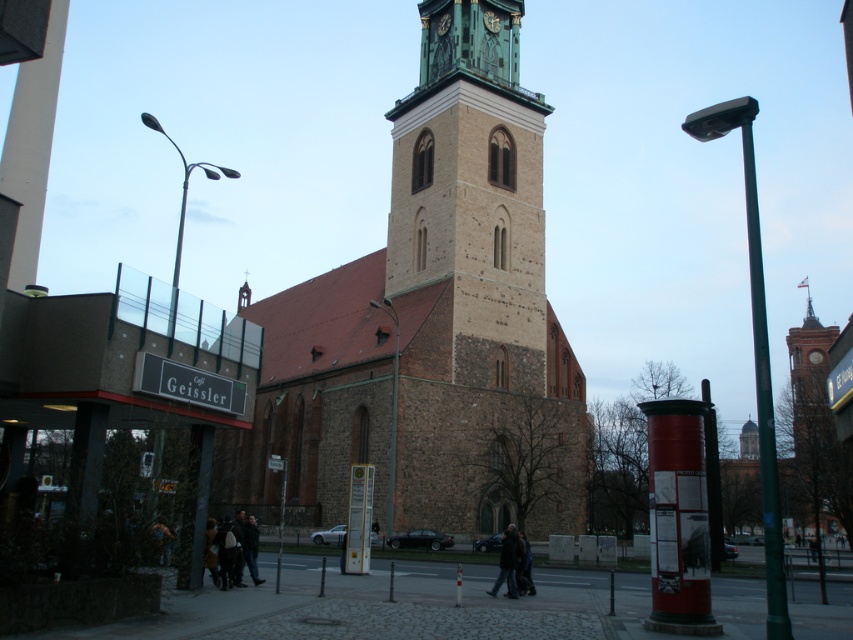
You are standing on the sidewalk in front of the historic church. If you face the church, where would you find the brown stone church at center relative to your position?

The brown stone church at center is located directly in front of you at the center point of the scene, as its 2D coordinates are at approximately the center of the image.

You are a tourist standing on the sidewalk and want to take a photo of both the brown stone church at center and the brown stone tower at center. Which one should you frame wider in your camera to capture its full structure?

The brown stone church at center should be framed wider because its width surpasses that of the brown stone tower at center.

You are a tourist standing on the sidewalk and want to take a photo of both the brown stone church at center and the brown stone tower at center. Since you have a wide angle lens, you need to know which one is bigger to frame the shot properly. Which object is larger?

The brown stone church at center is larger than the brown stone tower at center, so you should frame the shot to accommodate its size.